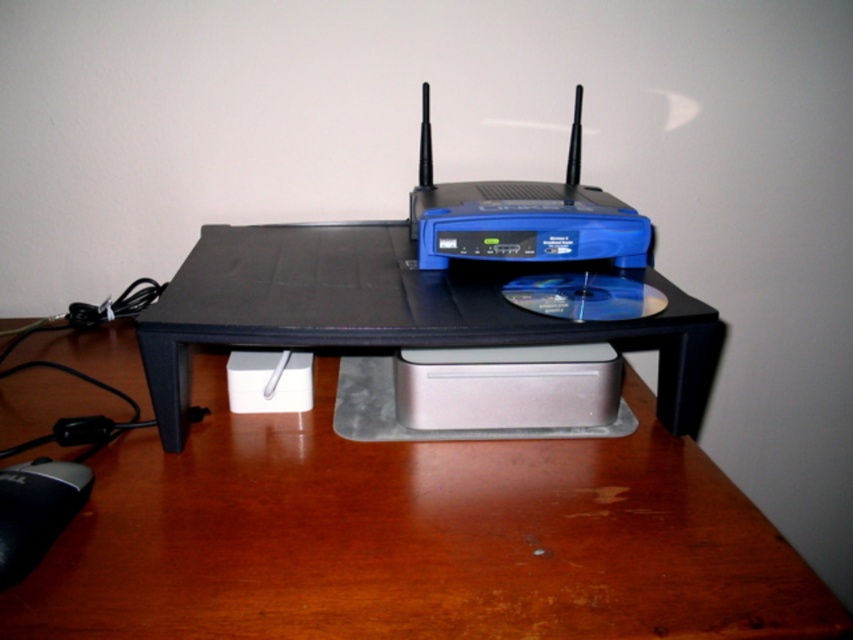
Does black plastic table at center have a greater height compared to black rubber mouse at lower left?

Yes, black plastic table at center is taller than black rubber mouse at lower left.

Is black plastic table at center to the right of black rubber mouse at lower left from the viewer's perspective?

Yes, black plastic table at center is to the right of black rubber mouse at lower left.

Is point (741, 584) positioned before point (9, 488)?

Yes, it is in front of point (9, 488).

The height and width of the screenshot is (640, 853). I want to click on black plastic table at center, so click(413, 538).